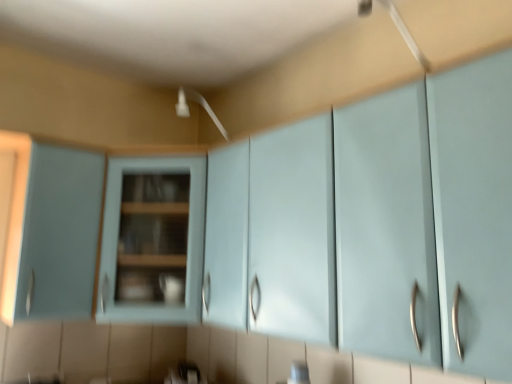
Question: Considering the positions of matte light blue cabinet at left, which ranks as the first cabinetry in left-to-right order, and matte blue cabinet at center, the second cabinetry when ordered from left to right, in the image, is matte light blue cabinet at left, which ranks as the first cabinetry in left-to-right order, taller or shorter than matte blue cabinet at center, the second cabinetry when ordered from left to right,?

Choices:
 (A) short
 (B) tall

Answer: (B)

Question: Is matte light blue cabinet at left, which ranks as the first cabinetry in left-to-right order, spatially inside matte blue cabinet at center, which is counted as the first cabinetry, starting from the right, or outside of it?

Choices:
 (A) outside
 (B) inside

Answer: (A)

Question: From a real-world perspective, relative to matte blue cabinet at center, the second cabinetry when ordered from left to right, is matte light blue cabinet at left, the second cabinetry from the right, vertically above or below?

Choices:
 (A) below
 (B) above

Answer: (B)

Question: In terms of height, does matte blue cabinet at center, the second cabinetry when ordered from left to right, look taller or shorter compared to matte light blue cabinet at left, the second cabinetry from the right?

Choices:
 (A) tall
 (B) short

Answer: (B)

Question: Visually, is matte blue cabinet at center, the second cabinetry when ordered from left to right, positioned to the left or to the right of matte light blue cabinet at left, which ranks as the first cabinetry in left-to-right order?

Choices:
 (A) left
 (B) right

Answer: (B)

Question: Do you think matte blue cabinet at center, which is counted as the first cabinetry, starting from the right, is within matte light blue cabinet at left, which ranks as the first cabinetry in left-to-right order, or outside of it?

Choices:
 (A) inside
 (B) outside

Answer: (B)

Question: Looking at their shapes, would you say matte blue cabinet at center, which is counted as the first cabinetry, starting from the right, is wider or thinner than matte light blue cabinet at left, the second cabinetry from the right?

Choices:
 (A) thin
 (B) wide

Answer: (B)